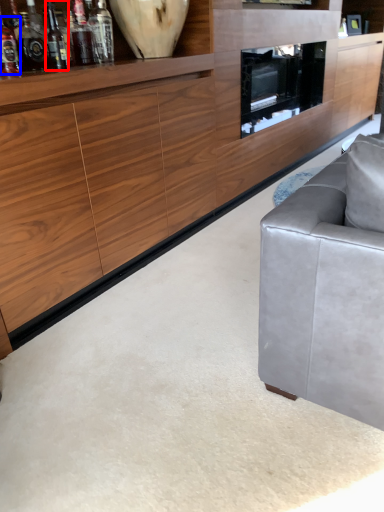
Question: Among these objects, which one is farthest to the camera, wine bottle (highlighted by a red box) or bottle (highlighted by a blue box)?

Choices:
 (A) wine bottle
 (B) bottle

Answer: (B)